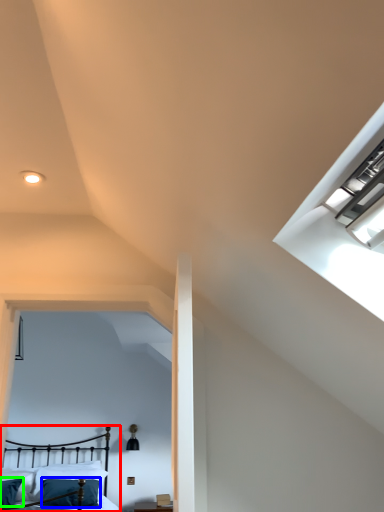
Question: Based on their relative distances, which object is farther from bed (highlighted by a red box)? Choose from pillow (highlighted by a blue box) and pillow (highlighted by a green box).

Choices:
 (A) pillow
 (B) pillow

Answer: (B)